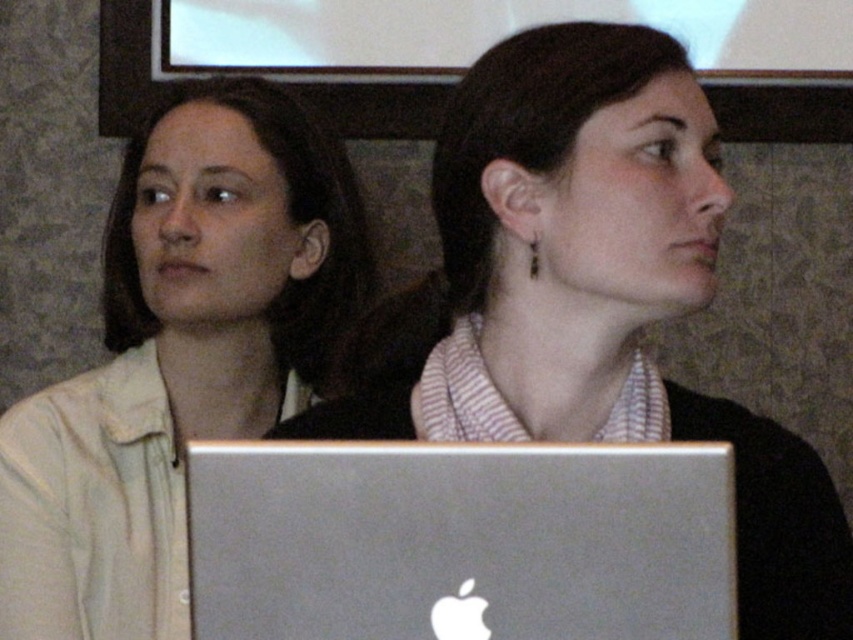
Question: Which point appears closest to the camera in this image?

Choices:
 (A) (625, 420)
 (B) (653, 474)

Answer: (B)

Question: Does metallic silver laptop at center have a larger size compared to silver metallic laptop at center?

Choices:
 (A) yes
 (B) no

Answer: (A)

Question: Considering the real-world distances, which object is farthest from the silver metallic laptop at center?

Choices:
 (A) metallic silver laptop at center
 (B) matte beige shirt at left

Answer: (B)

Question: Is metallic silver laptop at center below silver metallic laptop at center?

Choices:
 (A) yes
 (B) no

Answer: (B)

Question: Is matte beige shirt at left bigger than silver metallic laptop at center?

Choices:
 (A) no
 (B) yes

Answer: (B)

Question: Based on their relative distances, which object is farther from the silver metallic laptop at center?

Choices:
 (A) matte beige shirt at left
 (B) metallic silver laptop at center

Answer: (A)